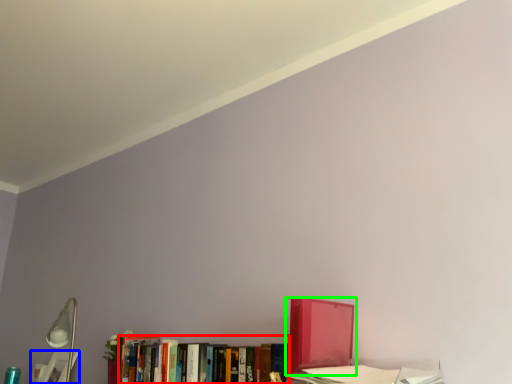
Question: Estimate the real-world distances between objects in this image. Which object is farther from book (highlighted by a red box), book (highlighted by a blue box) or book (highlighted by a green box)?

Choices:
 (A) book
 (B) book

Answer: (A)